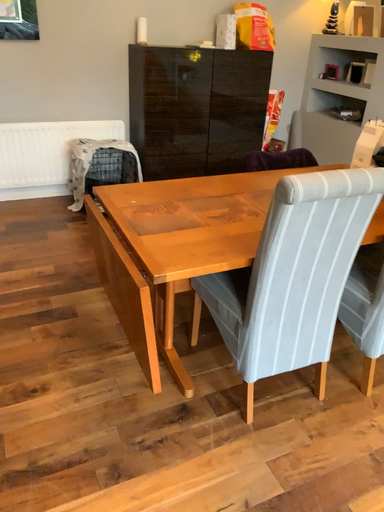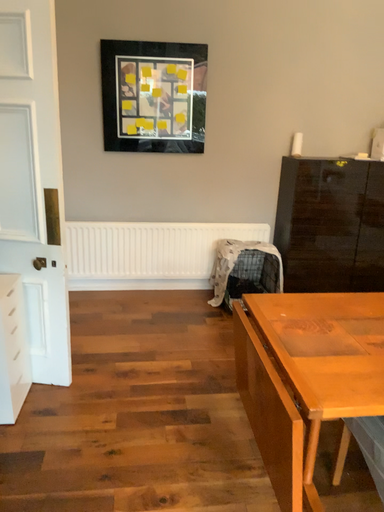
Question: How did the camera likely rotate when shooting the video?

Choices:
 (A) rotated downward
 (B) rotated upward

Answer: (B)